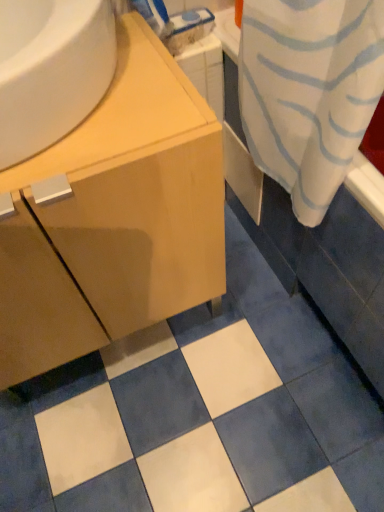
Question: Should I look upward or downward to see light wood cabinet at center?

Choices:
 (A) up
 (B) down

Answer: (A)

Question: Considering the relative positions of wooden counter at upper left and light wood cabinet at center in the image provided, is wooden counter at upper left to the right of light wood cabinet at center from the viewer's perspective?

Choices:
 (A) yes
 (B) no

Answer: (A)

Question: Is wooden counter at upper left beside light wood cabinet at center?

Choices:
 (A) yes
 (B) no

Answer: (B)

Question: Is wooden counter at upper left outside of light wood cabinet at center?

Choices:
 (A) no
 (B) yes

Answer: (B)

Question: Is wooden counter at upper left turned away from light wood cabinet at center?

Choices:
 (A) yes
 (B) no

Answer: (B)

Question: Could light wood cabinet at center be considered to be inside wooden counter at upper left?

Choices:
 (A) yes
 (B) no

Answer: (B)

Question: From the image's perspective, is wooden counter at upper left beneath light wood cabinet at center?

Choices:
 (A) no
 (B) yes

Answer: (A)

Question: Considering the relative sizes of light wood cabinet at center and wooden counter at upper left in the image provided, is light wood cabinet at center smaller than wooden counter at upper left?

Choices:
 (A) yes
 (B) no

Answer: (B)

Question: Can you confirm if light wood cabinet at center is taller than wooden counter at upper left?

Choices:
 (A) no
 (B) yes

Answer: (B)

Question: Is light wood cabinet at center beside wooden counter at upper left?

Choices:
 (A) yes
 (B) no

Answer: (B)

Question: Does light wood cabinet at center appear on the left side of wooden counter at upper left?

Choices:
 (A) no
 (B) yes

Answer: (B)

Question: From a real-world perspective, is light wood cabinet at center beneath wooden counter at upper left?

Choices:
 (A) no
 (B) yes

Answer: (B)

Question: From the image's perspective, is light wood cabinet at center over wooden counter at upper left?

Choices:
 (A) no
 (B) yes

Answer: (A)

Question: Based on their sizes in the image, would you say wooden counter at upper left is bigger or smaller than light wood cabinet at center?

Choices:
 (A) big
 (B) small

Answer: (B)